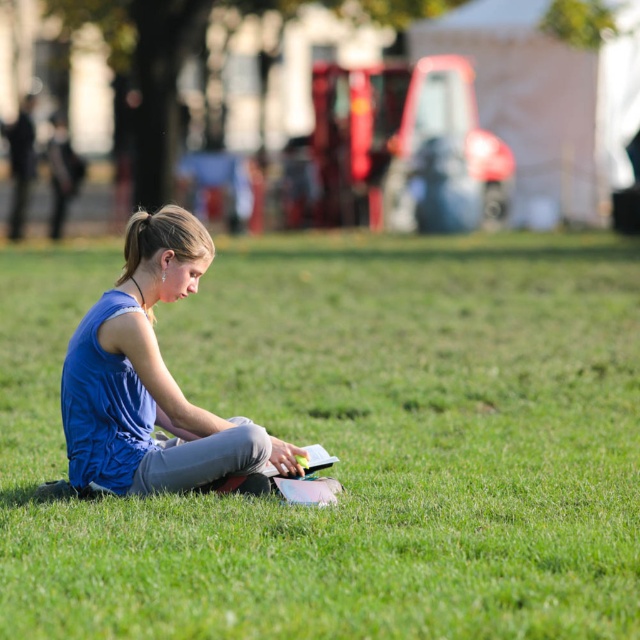
Question: Which object appears closest to the camera in this image?

Choices:
 (A) blue fabric girl at center
 (B) green grassy at center

Answer: (B)

Question: Does green grassy at center have a greater width compared to blue fabric girl at center?

Choices:
 (A) yes
 (B) no

Answer: (A)

Question: Which of the following is the closest to the observer?

Choices:
 (A) (483, 588)
 (B) (177, 465)

Answer: (A)

Question: Is green grassy at center to the left of blue fabric girl at center from the viewer's perspective?

Choices:
 (A) yes
 (B) no

Answer: (A)

Question: Which point is closer to the camera?

Choices:
 (A) green grassy at center
 (B) blue fabric girl at center

Answer: (A)

Question: Does green grassy at center come behind blue fabric girl at center?

Choices:
 (A) no
 (B) yes

Answer: (A)